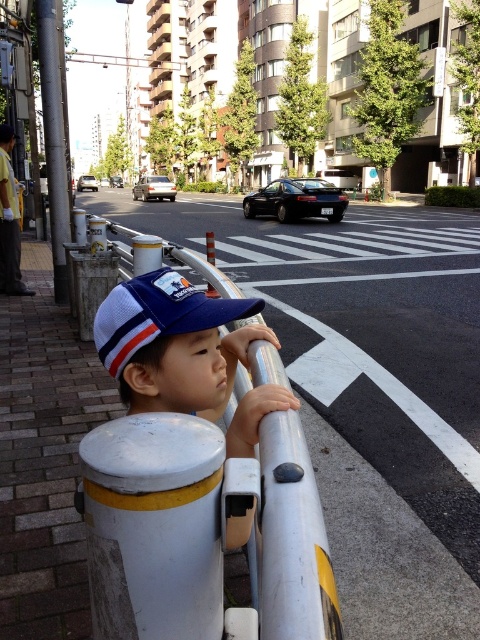
Question: Where is white metallic rail at center located in relation to yellow reflective vest at left in the image?

Choices:
 (A) below
 (B) above

Answer: (A)

Question: Is white metallic rail at center smaller than matte blue cap at center?

Choices:
 (A) yes
 (B) no

Answer: (B)

Question: In this image, where is silver metallic pole at left located relative to yellow reflective vest at left?

Choices:
 (A) above
 (B) below

Answer: (A)

Question: Which point is closer to the camera?

Choices:
 (A) silver metallic pole at left
 (B) yellow reflective vest at left
 (C) white metallic rail at center

Answer: (C)

Question: Which object appears farthest from the camera in this image?

Choices:
 (A) silver metallic pole at left
 (B) matte blue cap at center
 (C) yellow reflective vest at left
 (D) white metallic rail at center

Answer: (C)

Question: Which object is the closest to the white metallic rail at center?

Choices:
 (A) silver metallic pole at left
 (B) yellow reflective vest at left

Answer: (A)